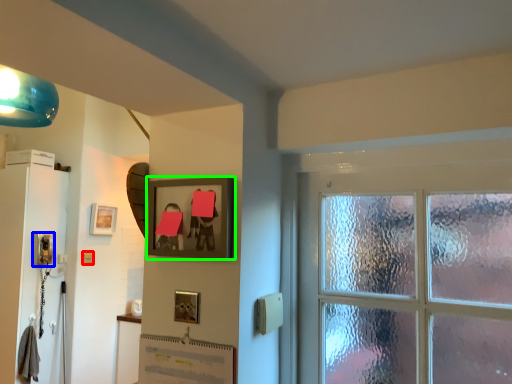
Question: Considering the real-world distances, which object is closest to light switch (highlighted by a red box)? corded phone (highlighted by a blue box) or picture frame (highlighted by a green box).

Choices:
 (A) corded phone
 (B) picture frame

Answer: (A)